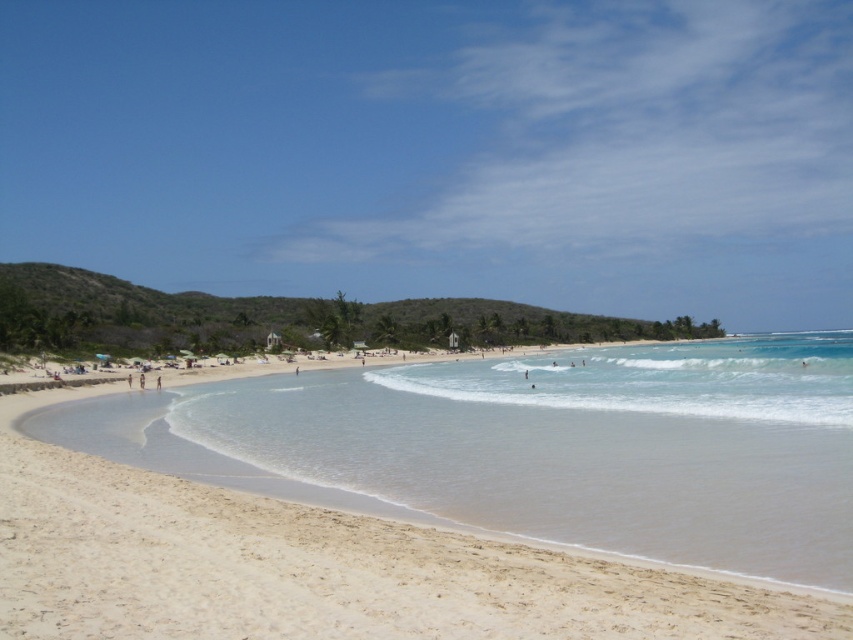
Between white sand beach at center and clear blue water at center, which one appears on the left side from the viewer's perspective?

From the viewer's perspective, white sand beach at center appears more on the left side.

Does white sand beach at center have a lesser height compared to clear blue water at center?

No.

At what (x,y) coordinates should I click in order to perform the action: click on white sand beach at center. Please return your answer as a coordinate pair (x, y). This screenshot has height=640, width=853. Looking at the image, I should click on (444, 499).